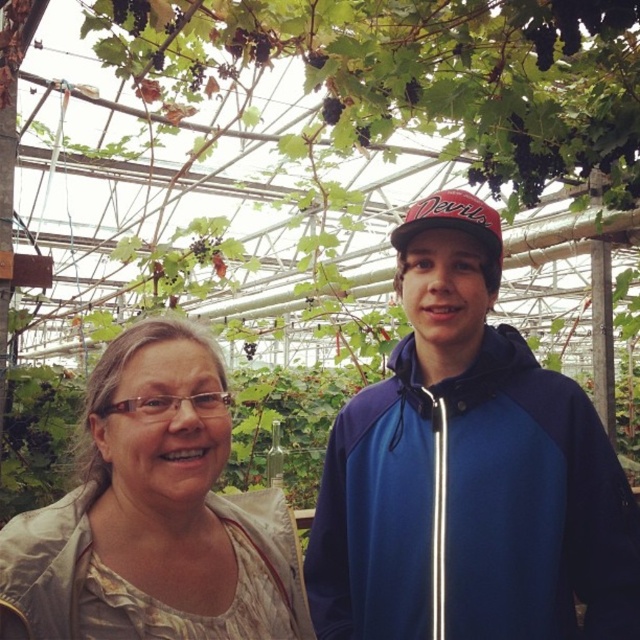
Is point (161, 448) positioned in front of point (403, 220)?

Yes.

Consider the image. Can you confirm if light beige fabric at center is wider than red fabric baseball cap at center?

Indeed, light beige fabric at center has a greater width compared to red fabric baseball cap at center.

Is point (125, 356) less distant than point (477, 225)?

Yes.

I want to click on light beige fabric at center, so click(154, 515).

Which is above, blue fleece jacket at center or light beige fabric at center?

blue fleece jacket at center is above.

Which of these two, blue fleece jacket at center or light beige fabric at center, stands shorter?

light beige fabric at center is shorter.

Measure the distance between blue fleece jacket at center and camera.

They are 1.63 meters apart.

This screenshot has width=640, height=640. Find the location of `blue fleece jacket at center`. blue fleece jacket at center is located at coordinates (468, 468).

Who is shorter, blue fleece jacket at center or red fabric baseball cap at center?

red fabric baseball cap at center

Describe the element at coordinates (468, 468) in the screenshot. I see `blue fleece jacket at center` at that location.

Between point (324, 608) and point (410, 205), which one is positioned behind?

Positioned behind is point (410, 205).

The image size is (640, 640). In order to click on blue fleece jacket at center in this screenshot , I will do `click(468, 468)`.